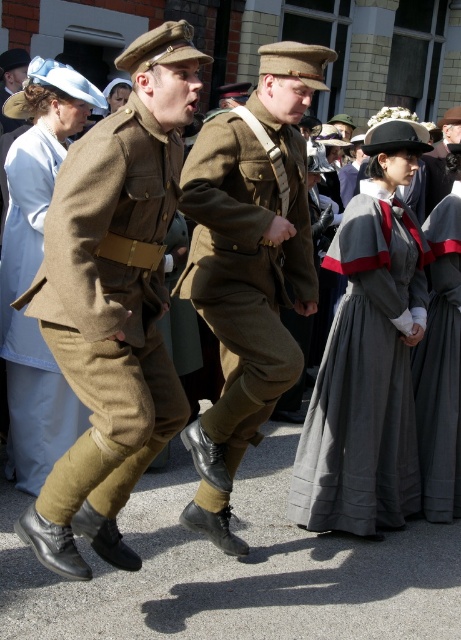
Question: Is matte brown uniform at center to the left of khaki wool uniform at center from the viewer's perspective?

Choices:
 (A) yes
 (B) no

Answer: (A)

Question: Which of these objects is positioned farthest from the khaki wool uniform at center?

Choices:
 (A) dark gray cotton dress at center
 (B) matte brown uniform at center

Answer: (A)

Question: Estimate the real-world distances between objects in this image. Which object is farther from the dark gray cotton dress at center?

Choices:
 (A) khaki wool uniform at center
 (B) matte brown uniform at center
 (C) gray cotton dress at center

Answer: (B)

Question: Does matte brown uniform at center appear under gray cotton dress at center?

Choices:
 (A) yes
 (B) no

Answer: (B)

Question: Is khaki wool uniform at center above gray cotton dress at center?

Choices:
 (A) no
 (B) yes

Answer: (B)

Question: Which object is positioned farthest from the matte brown uniform at center?

Choices:
 (A) khaki wool uniform at center
 (B) gray cotton dress at center
 (C) dark gray cotton dress at center

Answer: (C)